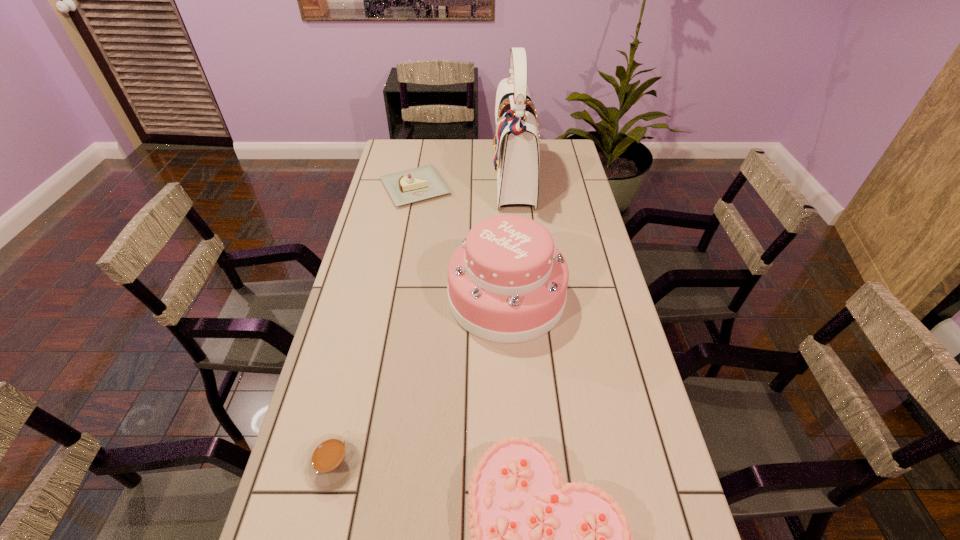
This screenshot has width=960, height=540. I want to click on vacant space located on the front of the farthest cake, so click(410, 218).

The image size is (960, 540). I want to click on vacant region located on the back of the cappuccino, so click(x=350, y=392).

This screenshot has width=960, height=540. In order to click on object that is at the far edge in this screenshot , I will do `click(516, 152)`.

Where is `cake present at the left edge`? cake present at the left edge is located at coordinates (404, 187).

The width and height of the screenshot is (960, 540). I want to click on cappuccino situated at the left edge, so click(x=333, y=460).

Where is `object located in the right edge section of the desktop`? This screenshot has width=960, height=540. object located in the right edge section of the desktop is located at coordinates (507, 283).

I want to click on free space at the far edge, so click(x=469, y=167).

In order to click on free region at the left edge of the desktop in this screenshot , I will do `click(357, 403)`.

The image size is (960, 540). I want to click on vacant space at the right edge of the desktop, so click(626, 410).

In the image, there is a desktop. Where is `vacant space at the far left corner`? This screenshot has width=960, height=540. vacant space at the far left corner is located at coordinates (399, 164).